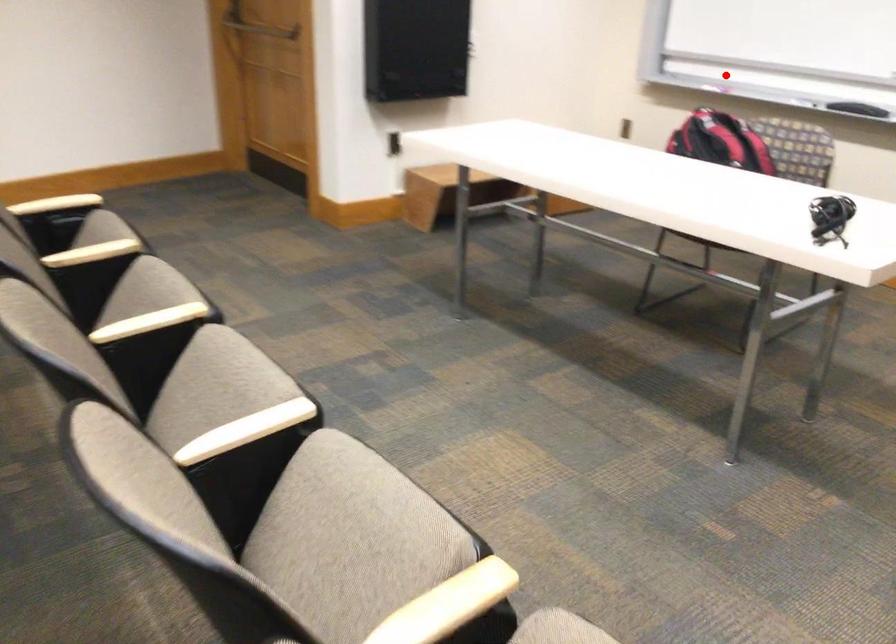
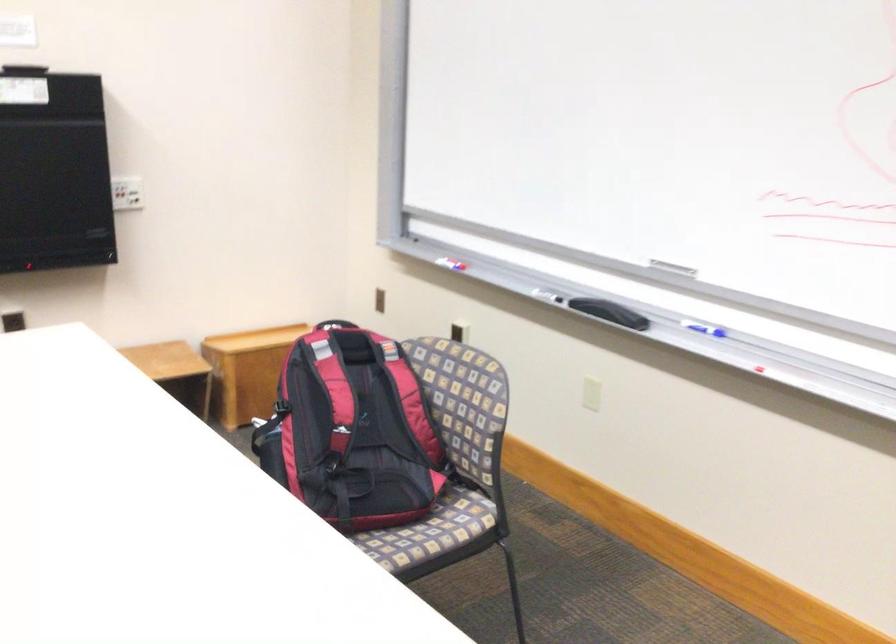
Question: I am providing you with two images of the same scene from different viewpoints. Image1 has a red point marked. In image2, the corresponding 3D location appears at what relative position? Reply with the corresponding letter.

Choices:
 (A) Closer
 (B) Farther

Answer: (A)